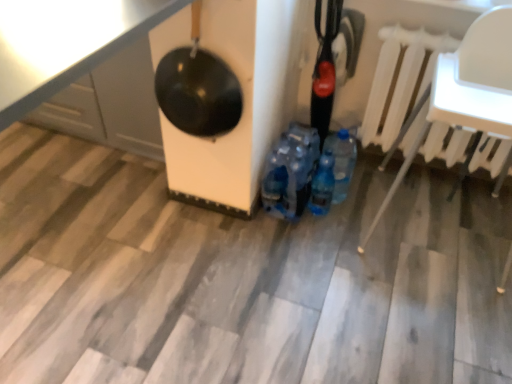
Locate an element on the screen. The width and height of the screenshot is (512, 384). free space to the left of blue translucent bottle at center is located at coordinates (283, 222).